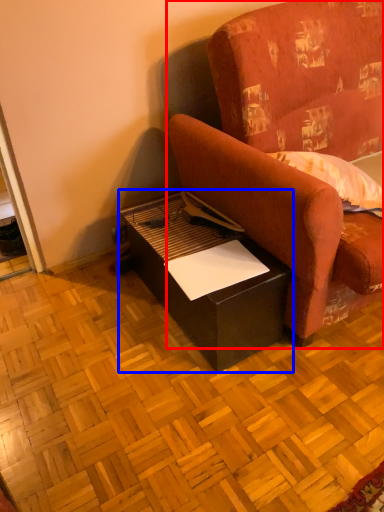
Question: Which of the following is the farthest to the observer, studio couch (highlighted by a red box) or table (highlighted by a blue box)?

Choices:
 (A) studio couch
 (B) table

Answer: (B)